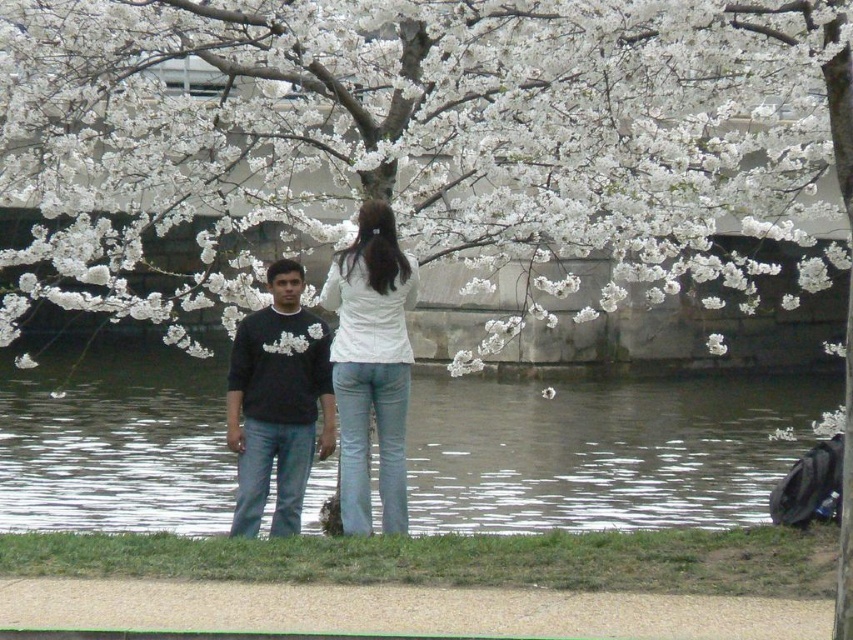
Which is in front, point (838, 35) or point (260, 380)?

Point (838, 35) is more forward.

Is white blossoms at center bigger than black matte sweater at center?

No, white blossoms at center is not bigger than black matte sweater at center.

Is point (370, 134) more distant than point (328, 448)?

Yes.

This screenshot has height=640, width=853. In order to click on white blossoms at center in this screenshot , I will do `click(427, 125)`.

Which of these two, clear water at center or black matte sweater at center, stands shorter?

With less height is clear water at center.

At what (x,y) coordinates should I click in order to perform the action: click on clear water at center. Please return your answer as a coordinate pair (x, y). Looking at the image, I should click on (602, 451).

Is white blossoms at center bigger than clear water at center?

No, white blossoms at center is not bigger than clear water at center.

Does white blossoms at center lie in front of clear water at center?

Yes, it is in front of clear water at center.

Which is in front, point (378, 58) or point (328, 483)?

Point (378, 58)

What are the coordinates of `white blossoms at center` in the screenshot? It's located at (427, 125).